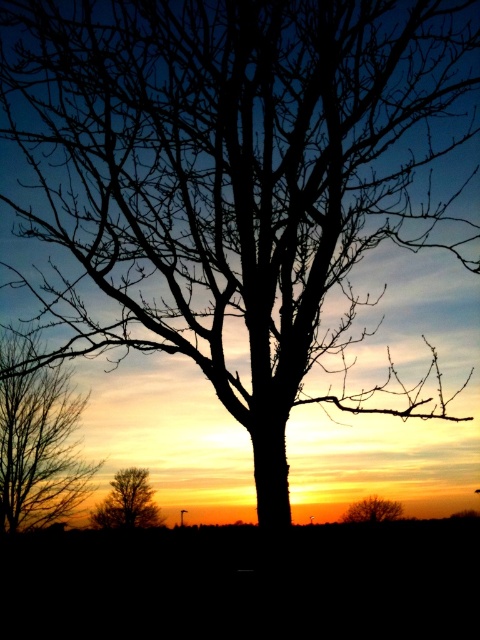
Based on the photo, you are standing in the sunset scene and want to place a small bird on one of the two points. The bird needs to be closer to the camera to be visible. Which point should you choose between point (20, 372) and point (358, 518)?

You should choose point (20, 372) because it is closer to the camera than point (358, 518), making the bird more visible.

You are standing in the middle of the scene and want to walk towards the brown textured tree at lower right. Which direction should you move relative to the brown textured tree at lower left?

The brown textured tree at lower left is to the left of the brown textured tree at lower right. To reach the brown textured tree at lower right, you should move to the right relative to the brown textured tree at lower left.

You are standing in the sunset scene and want to take a photo of the silhouette bare tree at left. To ensure the tree is centered in your photo, where should you aim your camera? Please provide coordinates based on the image grid system where the bottom left corner is the origin point.

You should aim your camera at the coordinates provided in the description, which is point (37, 442), to center the silhouette bare tree at left in your photo.